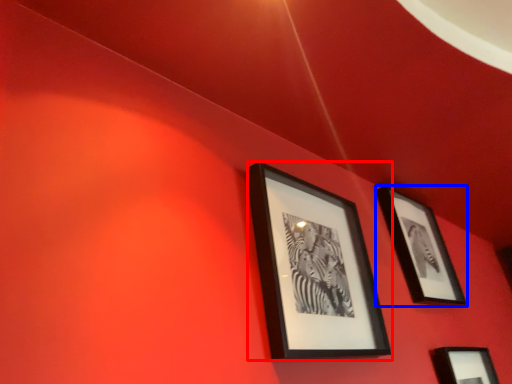
Question: Among these objects, which one is nearest to the camera, picture frame (highlighted by a red box) or picture frame (highlighted by a blue box)?

Choices:
 (A) picture frame
 (B) picture frame

Answer: (A)